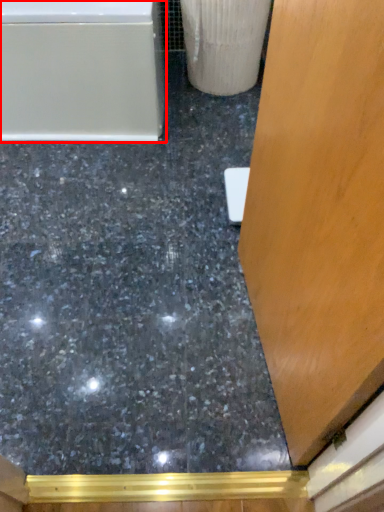
Question: From the image's perspective, where is bathtub (annotated by the red box) located relative to concrete?

Choices:
 (A) below
 (B) above

Answer: (B)